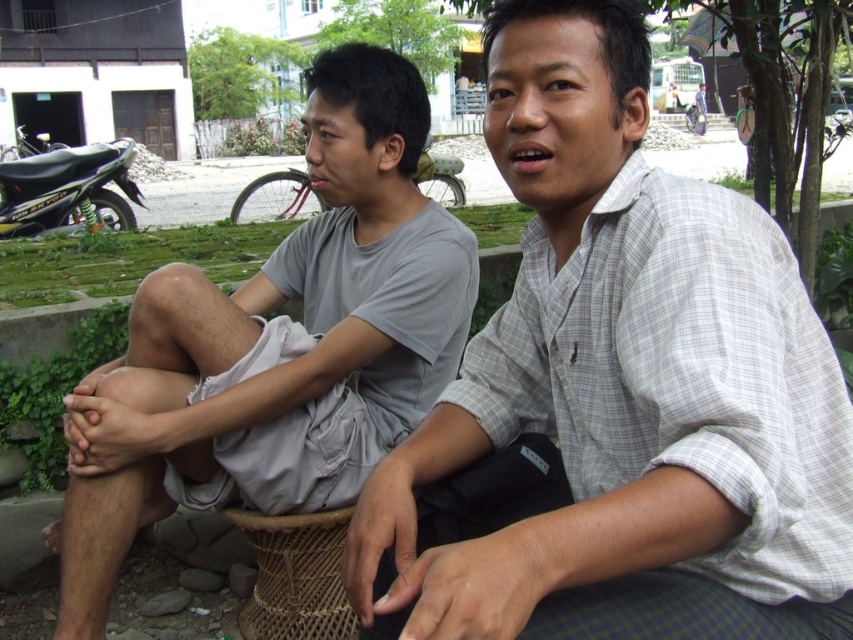
Can you confirm if shiny black motorcycle at left is positioned above metallic silver motorcycle at center?

No.

Measure the distance between shiny black motorcycle at left and metallic silver motorcycle at center.

The distance of shiny black motorcycle at left from metallic silver motorcycle at center is 11.85 feet.

Between point (99, 160) and point (320, 211), which one is positioned in front?

Point (99, 160) is more forward.

Identify the location of shiny black motorcycle at left. (67, 188).

Find the location of a particular element. white checkered shirt at center is located at coordinates (616, 394).

Measure the distance between white checkered shirt at center and camera.

white checkered shirt at center and camera are 36.00 inches apart from each other.

Which is behind, point (813, 340) or point (283, 198)?

The point (283, 198) is more distant.

Locate an element on the screen. white checkered shirt at center is located at coordinates (616, 394).

Can you confirm if gray cotton t-shirt at left is positioned to the left of shiny black motorcycle at left?

In fact, gray cotton t-shirt at left is to the right of shiny black motorcycle at left.

Does point (71, 509) lie in front of point (9, 224)?

Yes.

Is point (424, 232) farther from camera compared to point (115, 218)?

No, it is not.

Locate an element on the screen. This screenshot has height=640, width=853. gray cotton t-shirt at left is located at coordinates [x=277, y=346].